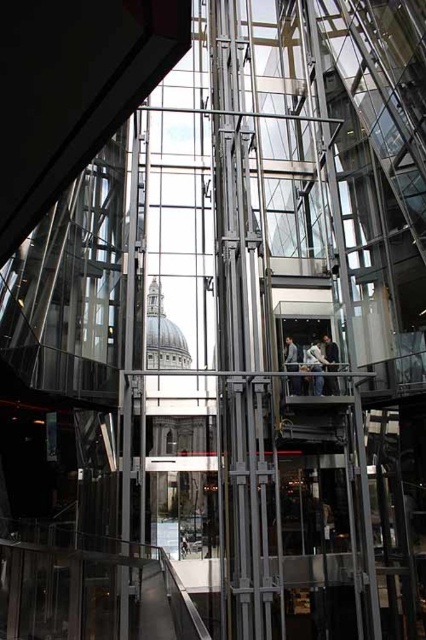
Question: Considering the real-world distances, which object is farthest from the light gray fabric jacket at center?

Choices:
 (A) dark gray fabric jacket at center
 (B) light beige fabric jacket at center

Answer: (A)

Question: Where is light beige fabric jacket at center located in relation to light gray fabric jacket at center in the image?

Choices:
 (A) right
 (B) left

Answer: (A)

Question: Considering the relative positions of light beige fabric jacket at center and light gray fabric jacket at center in the image provided, where is light beige fabric jacket at center located with respect to light gray fabric jacket at center?

Choices:
 (A) below
 (B) above

Answer: (B)

Question: Which object is the closest to the dark gray fabric jacket at center?

Choices:
 (A) light beige fabric jacket at center
 (B) light gray fabric jacket at center

Answer: (A)

Question: Can you confirm if light beige fabric jacket at center is smaller than dark gray fabric jacket at center?

Choices:
 (A) no
 (B) yes

Answer: (A)

Question: Estimate the real-world distances between objects in this image. Which object is farther from the dark gray fabric jacket at center?

Choices:
 (A) light beige fabric jacket at center
 (B) light gray fabric jacket at center

Answer: (B)